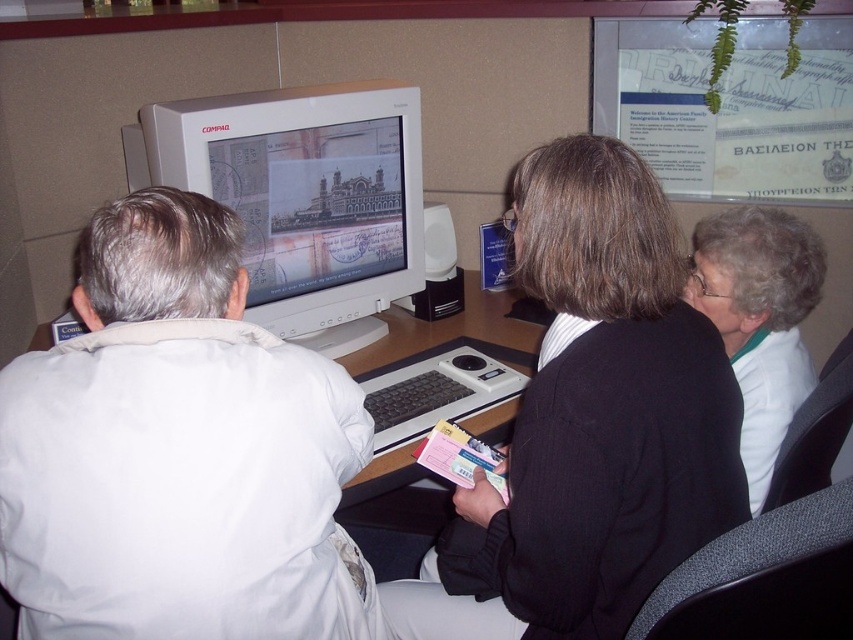
Does white matte computer monitor at center have a greater height compared to white fabric at right?

Indeed, white matte computer monitor at center has a greater height compared to white fabric at right.

Which is below, white matte computer monitor at center or white fabric at right?

Positioned lower is white fabric at right.

Describe the element at coordinates (303, 196) in the screenshot. I see `white matte computer monitor at center` at that location.

Find the location of a particular element. This screenshot has width=853, height=640. white matte computer monitor at center is located at coordinates (303, 196).

Is point (613, 568) in front of point (276, 93)?

Yes, it is.

Can you confirm if dark brown sweater at center is positioned to the left of white matte computer monitor at center?

No, dark brown sweater at center is not to the left of white matte computer monitor at center.

This screenshot has width=853, height=640. I want to click on dark brown sweater at center, so click(590, 420).

Who is lower down, white matte jacket at left or wooden desk at center?

white matte jacket at left is below.

Is point (195, 461) farther from viewer compared to point (387, 476)?

No, it is in front of (387, 476).

I want to click on white matte jacket at left, so click(178, 451).